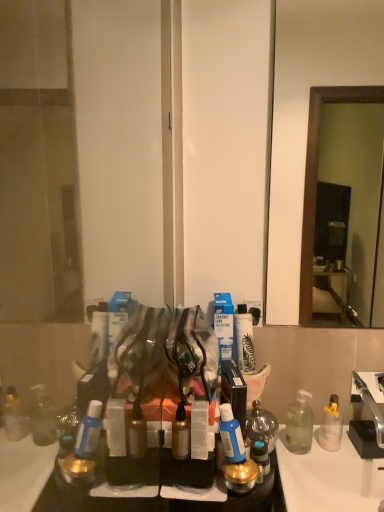
Question: Can you confirm if clear plastic soap dispenser at lower right is bigger than metallic gold toiletry at center, which is the 4th toiletry from left to right?

Choices:
 (A) yes
 (B) no

Answer: (A)

Question: Does clear plastic soap dispenser at lower right appear on the left side of metallic gold toiletry at center, the 2th toiletry from the right?

Choices:
 (A) yes
 (B) no

Answer: (B)

Question: Considering the relative sizes of clear plastic soap dispenser at lower right and metallic gold toiletry at center, the 2th toiletry from the right, in the image provided, is clear plastic soap dispenser at lower right thinner than metallic gold toiletry at center, the 2th toiletry from the right,?

Choices:
 (A) no
 (B) yes

Answer: (A)

Question: Is clear plastic soap dispenser at lower right not close to metallic gold toiletry at center, the 2th toiletry from the right?

Choices:
 (A) yes
 (B) no

Answer: (B)

Question: From a real-world perspective, is clear plastic soap dispenser at lower right beneath metallic gold toiletry at center, which is the 4th toiletry from left to right?

Choices:
 (A) yes
 (B) no

Answer: (A)

Question: Does clear plastic soap dispenser at lower right appear on the right side of metallic gold toiletry at center, which is the 4th toiletry from left to right?

Choices:
 (A) no
 (B) yes

Answer: (B)

Question: From the image's perspective, is blue glossy bottle at center, the third toiletry viewed from the left, under translucent glass jar at center, arranged as the 1th toiletry when viewed from the right?

Choices:
 (A) no
 (B) yes

Answer: (A)

Question: Does blue glossy bottle at center, the 3th toiletry from the right, appear on the left side of translucent glass jar at center, arranged as the 1th toiletry when viewed from the right?

Choices:
 (A) no
 (B) yes

Answer: (B)

Question: Would you say blue glossy bottle at center, the third toiletry viewed from the left, is a long distance from translucent glass jar at center, arranged as the 1th toiletry when viewed from the right?

Choices:
 (A) yes
 (B) no

Answer: (B)

Question: Considering the relative sizes of blue glossy bottle at center, the third toiletry viewed from the left, and translucent glass jar at center, arranged as the 1th toiletry when viewed from the right, in the image provided, is blue glossy bottle at center, the third toiletry viewed from the left, wider than translucent glass jar at center, arranged as the 1th toiletry when viewed from the right,?

Choices:
 (A) yes
 (B) no

Answer: (B)

Question: Is blue glossy bottle at center, the third toiletry viewed from the left, aimed at translucent glass jar at center, arranged as the 1th toiletry when viewed from the right?

Choices:
 (A) yes
 (B) no

Answer: (B)

Question: Can you confirm if blue glossy bottle at center, the third toiletry viewed from the left, is smaller than translucent glass jar at center, the 5th toiletry from the left?

Choices:
 (A) no
 (B) yes

Answer: (B)

Question: Is clear plastic soap dispenser at lower right taller than blue glossy bottle at center, the 3th toiletry from the right?

Choices:
 (A) yes
 (B) no

Answer: (A)